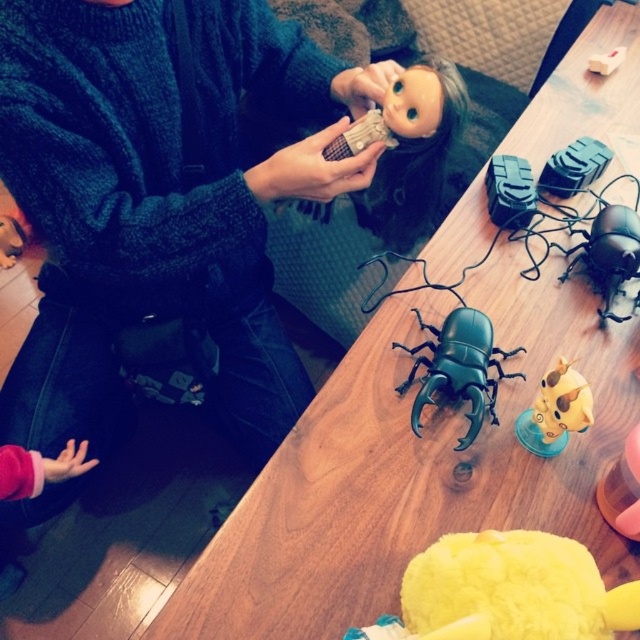
Question: Which of the following is the farthest from the observer?

Choices:
 (A) dark blue knitted sweater at upper left
 (B) green matte beetle at center
 (C) yellow plush toy at lower center

Answer: (A)

Question: Where is black matte beetle at right located in relation to yellow matte toy at center-right in the image?

Choices:
 (A) left
 (B) right

Answer: (B)

Question: Is yellow plush toy at lower center positioned before black matte beetle at right?

Choices:
 (A) no
 (B) yes

Answer: (B)

Question: Does green matte beetle at center appear over yellow matte toy at center-right?

Choices:
 (A) yes
 (B) no

Answer: (A)

Question: Which point is farther to the camera?

Choices:
 (A) (534, 432)
 (B) (192, 285)

Answer: (B)

Question: Which point is farther from the camera taking this photo?

Choices:
 (A) (598, 221)
 (B) (541, 422)

Answer: (A)